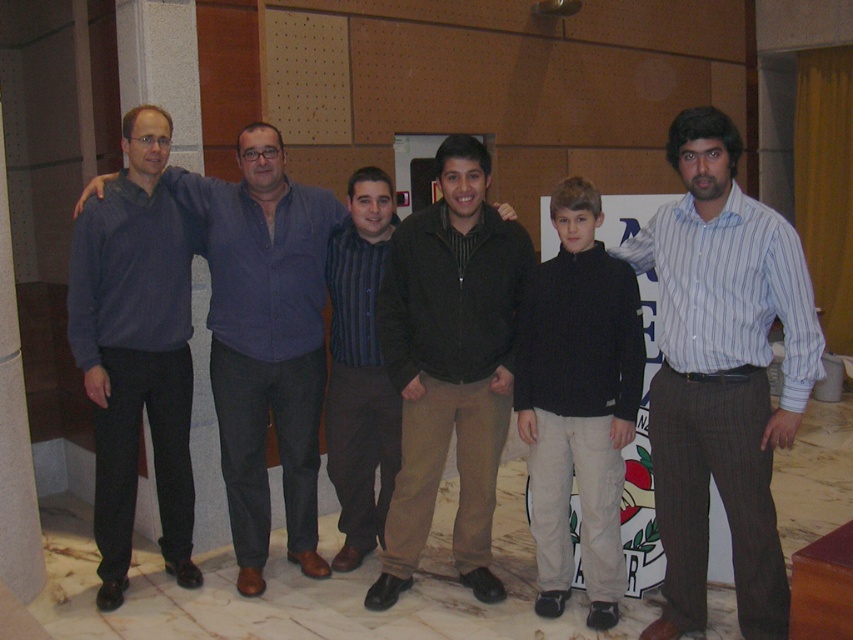
Question: Observing the image, what is the correct spatial positioning of blue striped shirt at center in reference to black fleece jacket at center?

Choices:
 (A) left
 (B) right

Answer: (B)

Question: Which point is closer to the camera?

Choices:
 (A) (289, 541)
 (B) (469, 474)
 (C) (601, 276)

Answer: (C)

Question: Can you confirm if black fleece jacket at center is positioned to the right of matte blue shirt at center?

Choices:
 (A) no
 (B) yes

Answer: (B)

Question: Which point is closer to the camera?

Choices:
 (A) (485, 339)
 (B) (584, 243)
 (C) (183, 184)
 (D) (173, 240)

Answer: (B)

Question: Which object appears closest to the camera in this image?

Choices:
 (A) blue striped shirt at center
 (B) dark brown corduroy jacket at center
 (C) black fleece jacket at center
 (D) matte blue sweater at left

Answer: (A)

Question: Can you confirm if dark brown corduroy jacket at center is thinner than matte blue shirt at center?

Choices:
 (A) yes
 (B) no

Answer: (A)